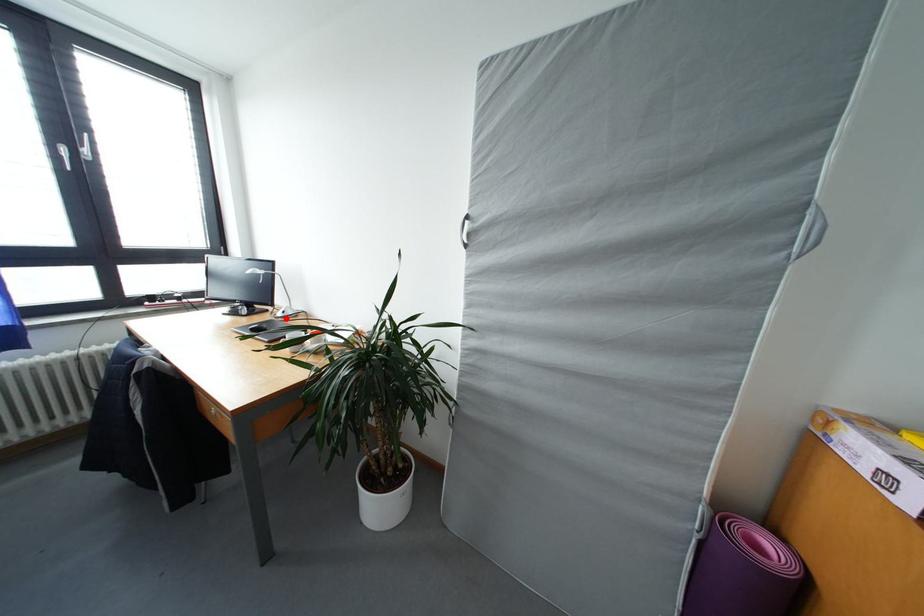
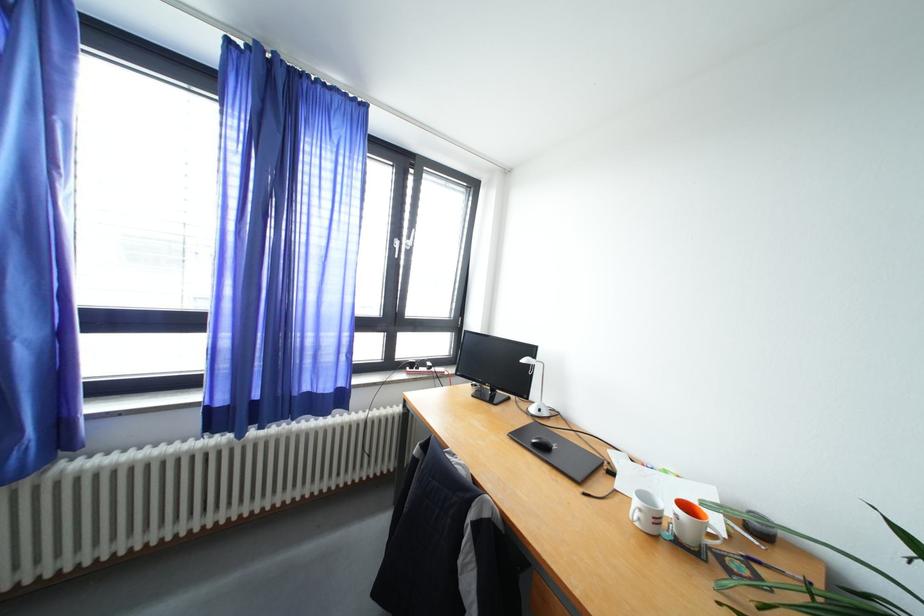
Where in the second image is the point corresponding to the highlighted location from the first image?

(540, 415)